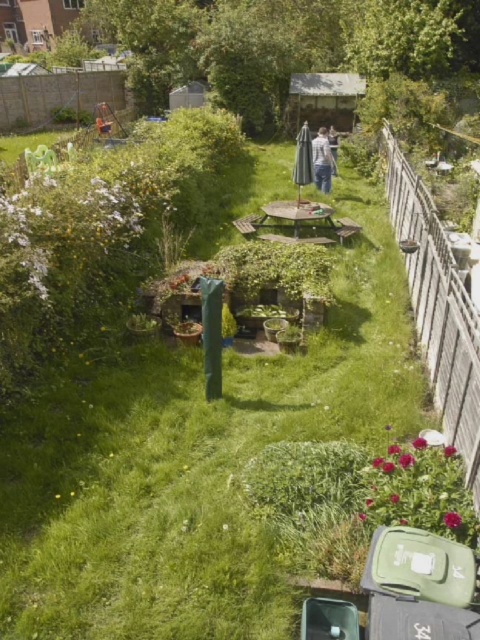
Which of these two, white wooden fence at right or white cotton shirt at center, stands shorter?

Standing shorter between the two is white cotton shirt at center.

The width and height of the screenshot is (480, 640). Describe the element at coordinates (437, 308) in the screenshot. I see `white wooden fence at right` at that location.

Is point (456, 438) positioned after point (317, 161)?

No.

In order to click on white wooden fence at right in this screenshot , I will do `click(437, 308)`.